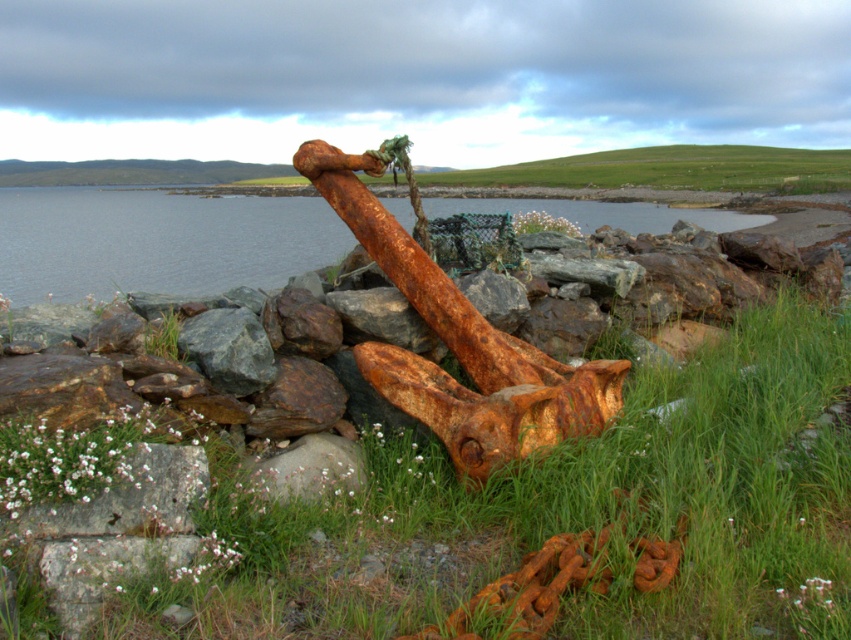
How distant is green grass at center from rusty metallic water at center?

green grass at center is 6.78 meters from rusty metallic water at center.

This screenshot has width=851, height=640. What are the coordinates of `green grass at center` in the screenshot? It's located at (566, 513).

I want to click on green grass at center, so click(566, 513).